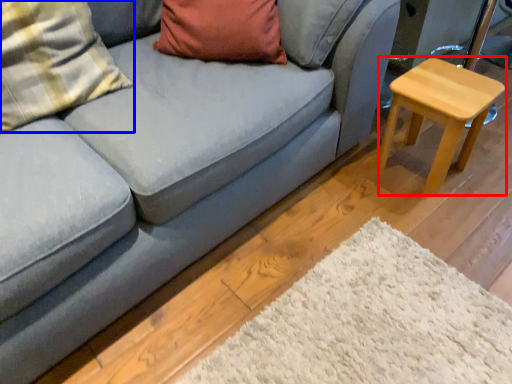
Question: Among these objects, which one is nearest to the camera, stool (highlighted by a red box) or pillow (highlighted by a blue box)?

Choices:
 (A) stool
 (B) pillow

Answer: (B)